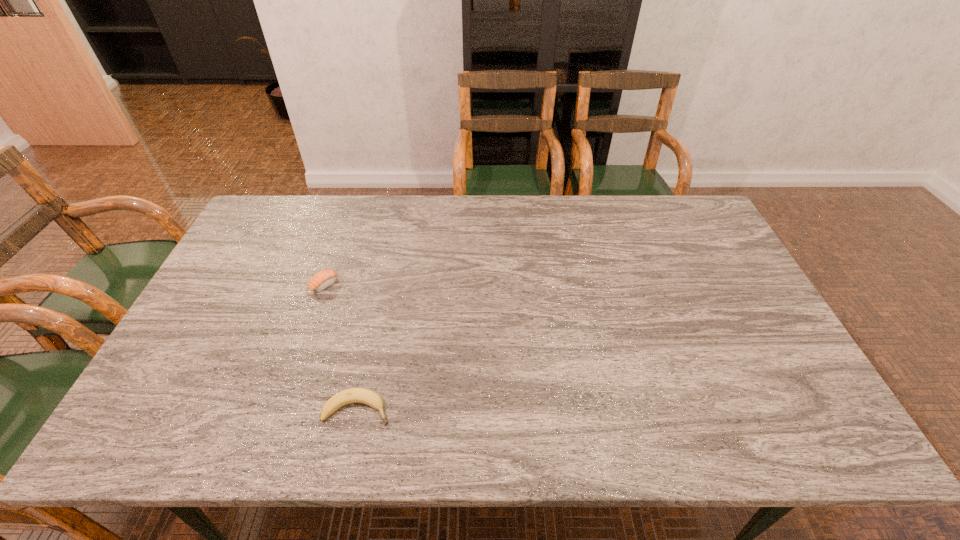
At what (x,y) coordinates should I click in order to perform the action: click on sushi. Please return your answer as a coordinate pair (x, y). The image size is (960, 540). Looking at the image, I should click on (323, 279).

The width and height of the screenshot is (960, 540). Find the location of `the left object`. the left object is located at coordinates (323, 279).

What are the coordinates of `the nearer object` in the screenshot? It's located at (353, 395).

Locate an element on the screen. the right object is located at coordinates (353, 395).

This screenshot has height=540, width=960. I want to click on vacant space situated 0.270m on the left of the sushi, so (x=220, y=284).

Locate an element on the screen. The height and width of the screenshot is (540, 960). vacant position located at the stem of the right object is located at coordinates (421, 409).

At what (x,y) coordinates should I click in order to perform the action: click on object that is at the near edge. Please return your answer as a coordinate pair (x, y). This screenshot has height=540, width=960. Looking at the image, I should click on click(353, 395).

In the image, there is a desktop. Identify the location of free region at the far edge. This screenshot has height=540, width=960. (410, 216).

In the image, there is a desktop. At what (x,y) coordinates should I click in order to perform the action: click on free space at the near edge. Please return your answer as a coordinate pair (x, y). The height and width of the screenshot is (540, 960). Looking at the image, I should click on (420, 429).

Find the location of a particular element. free space at the left edge is located at coordinates (226, 290).